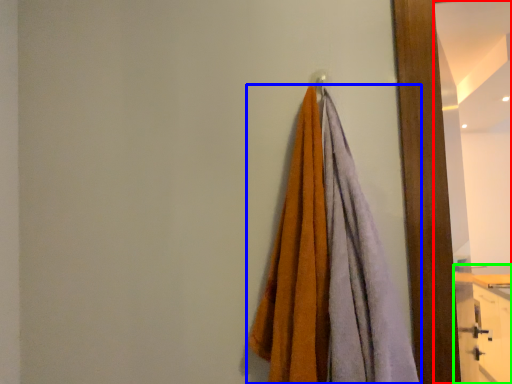
Question: Considering the real-world distances, which object is closest to mirror (highlighted by a red box)? towel (highlighted by a blue box) or dresser (highlighted by a green box).

Choices:
 (A) towel
 (B) dresser

Answer: (B)